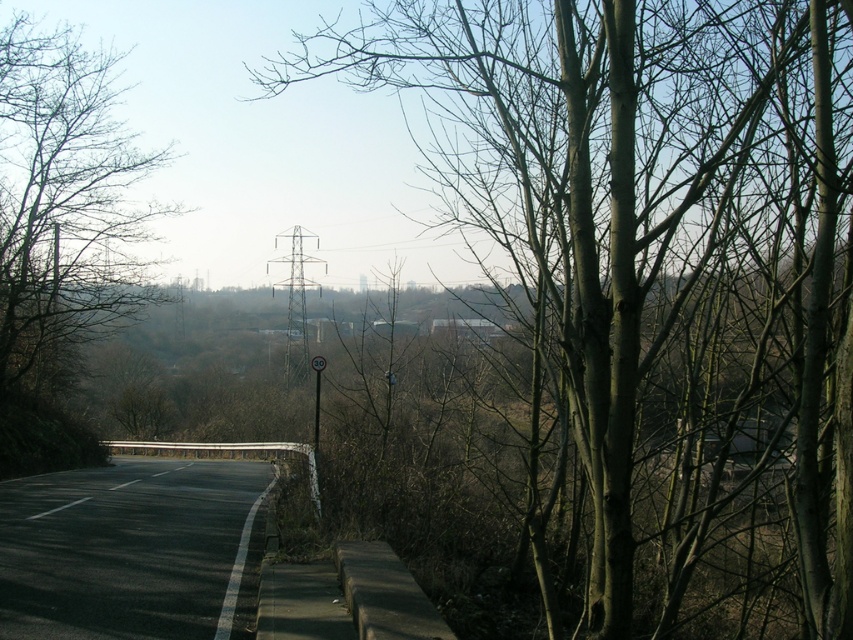
Question: Does brown rough tree at center appear on the right side of black asphalt highway at lower left?

Choices:
 (A) no
 (B) yes

Answer: (B)

Question: Estimate the real-world distances between objects in this image. Which object is farther from the black asphalt highway at lower left?

Choices:
 (A) brown rough tree at center
 (B) bare branches at left

Answer: (A)

Question: Can you confirm if bare branches at left is thinner than black asphalt highway at lower left?

Choices:
 (A) no
 (B) yes

Answer: (B)

Question: Among these points, which one is nearest to the camera?

Choices:
 (A) (180, 516)
 (B) (772, 390)
 (C) (33, 102)

Answer: (B)

Question: Estimate the real-world distances between objects in this image. Which object is closer to the brown rough tree at center?

Choices:
 (A) bare branches at left
 (B) black asphalt highway at lower left

Answer: (B)

Question: Is bare branches at left thinner than black asphalt highway at lower left?

Choices:
 (A) no
 (B) yes

Answer: (B)